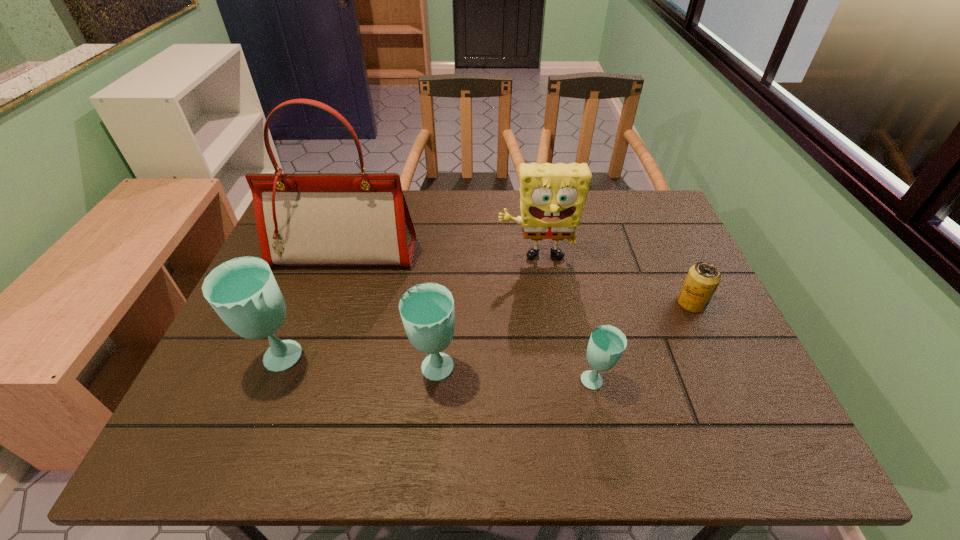
In the image, there is a desktop. Where is `vacant space at the near edge`? The height and width of the screenshot is (540, 960). vacant space at the near edge is located at coordinates (551, 383).

The image size is (960, 540). I want to click on vacant area at the left edge, so click(286, 274).

Locate an element on the screen. This screenshot has width=960, height=540. free space at the right edge is located at coordinates (717, 315).

Find the location of a particular element. The width and height of the screenshot is (960, 540). vacant space at the near left corner of the desktop is located at coordinates (231, 381).

You are a GUI agent. You are given a task and a screenshot of the screen. Output one action in this format:
    pyautogui.click(x=<x>, y=<y>)
    Task: Click on the vacant space at the far right corner
    The height and width of the screenshot is (540, 960).
    Given the screenshot: What is the action you would take?
    pyautogui.click(x=651, y=222)

Find the location of a particular element. free spot between the leftmost glass and the tallest object is located at coordinates (312, 308).

Find the location of a particular element. unoccupied area between the handbag and the sponge is located at coordinates (441, 256).

At what (x,y) coordinates should I click in order to perform the action: click on free space between the handbag and the second glass from left to right. Please return your answer as a coordinate pair (x, y). This screenshot has width=960, height=540. Looking at the image, I should click on (390, 313).

Locate an element on the screen. The height and width of the screenshot is (540, 960). unoccupied position between the second glass from right to left and the leftmost glass is located at coordinates (357, 366).

The width and height of the screenshot is (960, 540). I want to click on vacant area that lies between the handbag and the shortest object, so click(x=518, y=279).